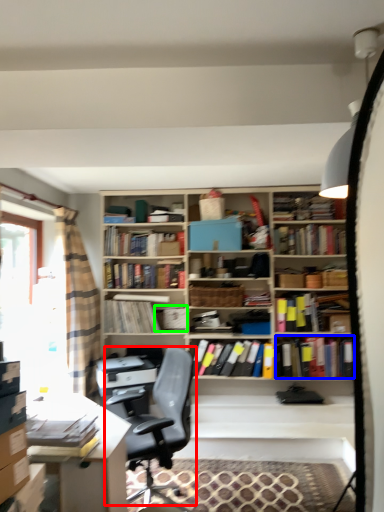
Question: Based on their relative distances, which object is farther from chair (highlighted by a red box)? Choose from book (highlighted by a blue box) and book (highlighted by a green box).

Choices:
 (A) book
 (B) book

Answer: (A)